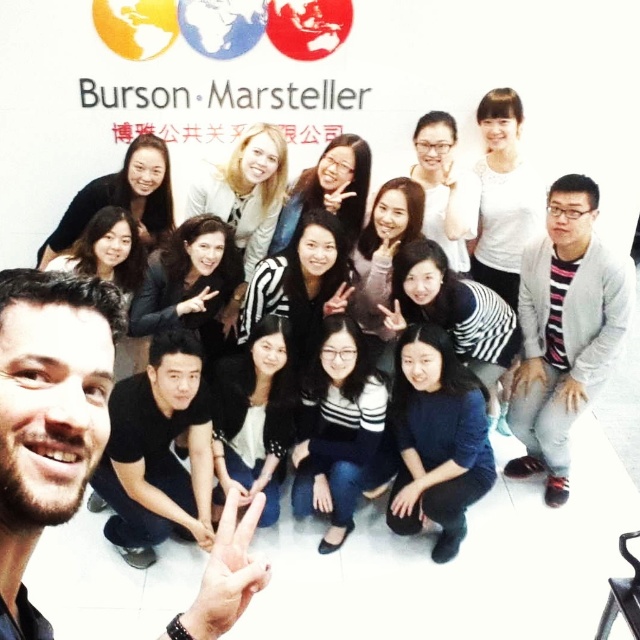
Who is lower down, brown leather wallet at lower left or matte black hair at center?

brown leather wallet at lower left is lower down.

Is brown leather wallet at lower left below matte black hair at center?

Yes.

Looking at this image, who is more forward, (45, 387) or (369, 168)?

Point (45, 387) is more forward.

Where is `brown leather wallet at lower left`? This screenshot has width=640, height=640. brown leather wallet at lower left is located at coordinates (48, 417).

In the scene shown: Is gray striped sweater at lower right to the left of white matte sweater at upper center from the viewer's perspective?

No, gray striped sweater at lower right is not to the left of white matte sweater at upper center.

Is gray striped sweater at lower right above white matte sweater at upper center?

No, gray striped sweater at lower right is not above white matte sweater at upper center.

At what (x,y) coordinates should I click in order to perform the action: click on gray striped sweater at lower right. Please return your answer as a coordinate pair (x, y). This screenshot has width=640, height=640. Looking at the image, I should click on (564, 330).

Which is more to the left, white matte shirt at upper right or white matte sweater at upper center?

Positioned to the left is white matte sweater at upper center.

In the scene shown: Is white matte shirt at upper right further to camera compared to white matte sweater at upper center?

Yes, white matte shirt at upper right is behind white matte sweater at upper center.

Identify the location of white matte shirt at upper right. The image size is (640, 640). (502, 195).